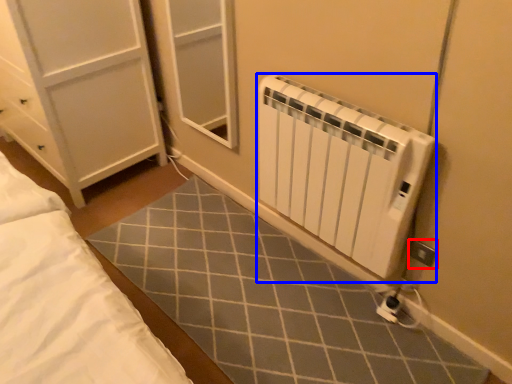
Question: Which point is further to the camera, electric outlet (highlighted by a red box) or radiator (highlighted by a blue box)?

Choices:
 (A) electric outlet
 (B) radiator

Answer: (A)